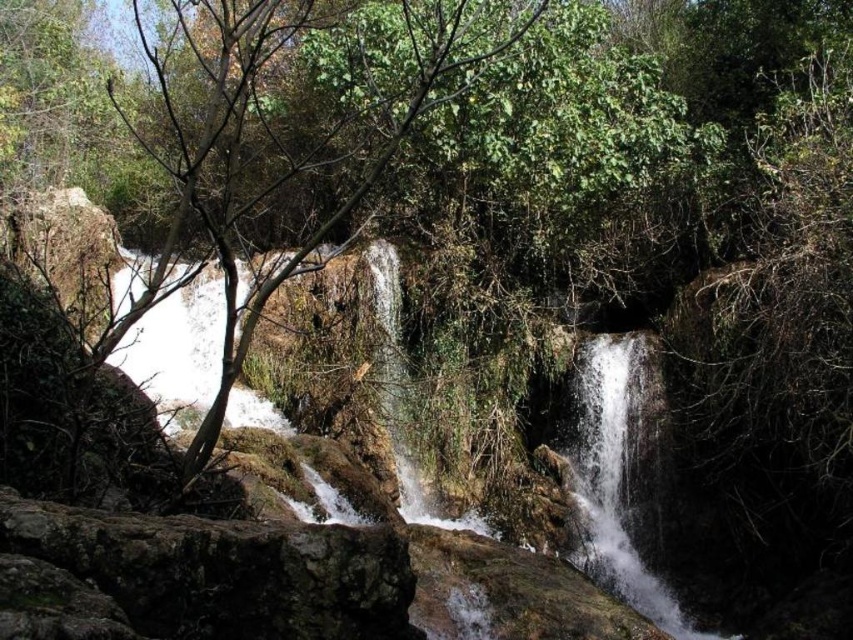
Is point (372, 586) in front of point (172, 426)?

That is True.

Is rough textured rock at center further to the viewer compared to white frothy water at center?

No, rough textured rock at center is in front of white frothy water at center.

Between point (13, 573) and point (178, 317), which one is positioned in front?

Positioned in front is point (13, 573).

Find the location of a particular element. The image size is (853, 640). rough textured rock at center is located at coordinates (195, 577).

Is white frothy water at center closer to the viewer compared to clear water at center?

Yes, white frothy water at center is closer to the viewer.

Does white frothy water at center have a greater height compared to clear water at center?

Indeed, white frothy water at center has a greater height compared to clear water at center.

Where is `white frothy water at center`? This screenshot has width=853, height=640. white frothy water at center is located at coordinates (618, 477).

Find the location of a particular element. rough textured rock at center is located at coordinates (195, 577).

Is rough textured rock at center behind clear water at center?

No.

Is point (73, 627) closer to viewer compared to point (587, 342)?

Yes.

The image size is (853, 640). What are the coordinates of `rough textured rock at center` in the screenshot? It's located at point(195,577).